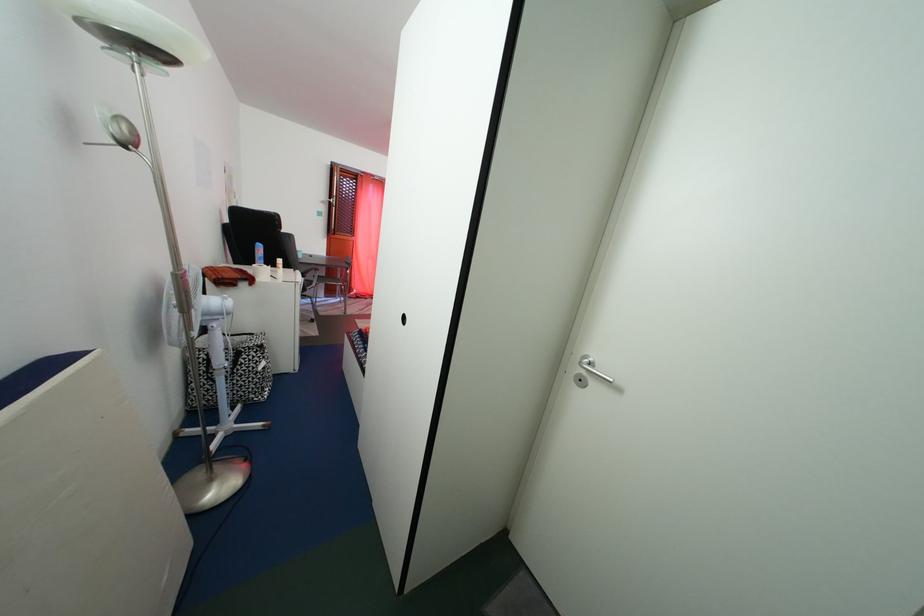
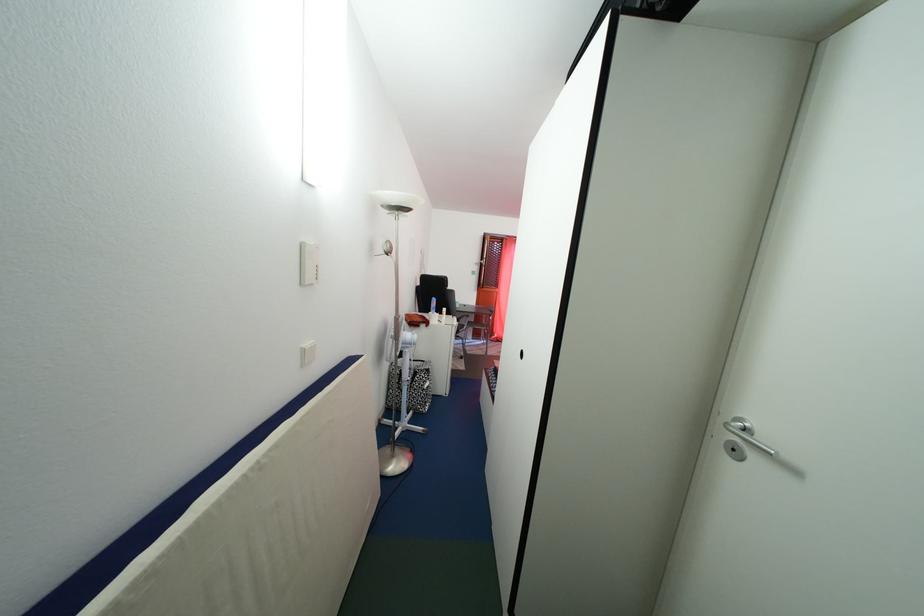
In the second image, find the point that corresponds to [590,387] in the first image.

(743, 456)